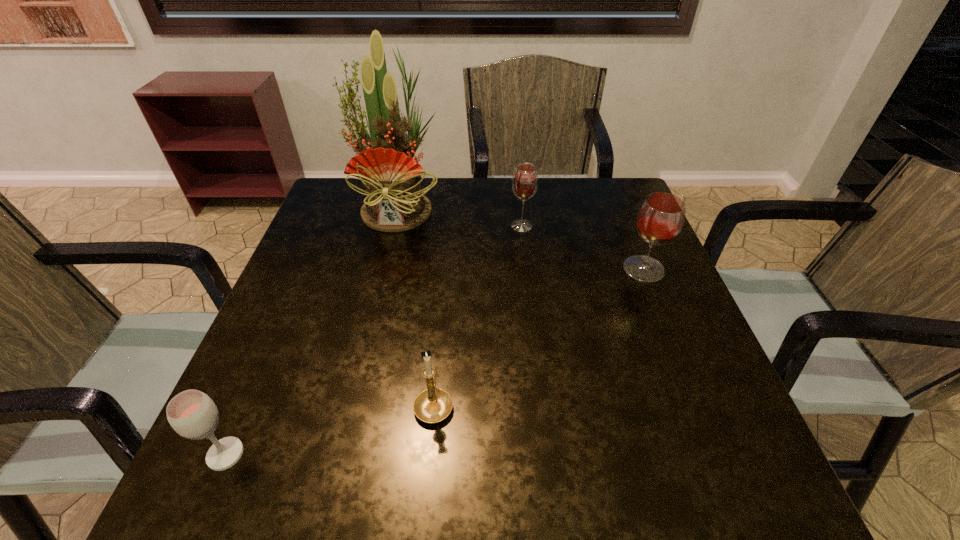
At what (x,y) coordinates should I click in order to perform the action: click on vacant region located 0.160m on the right of the second object from right to left. Please return your answer as a coordinate pair (x, y). Looking at the image, I should click on (595, 226).

Where is `vacant space located 0.110m on the handle side of the fourth farthest object`? The width and height of the screenshot is (960, 540). vacant space located 0.110m on the handle side of the fourth farthest object is located at coordinates [440, 336].

The height and width of the screenshot is (540, 960). Identify the location of free space located 0.390m on the handle side of the fourth farthest object. (447, 248).

The width and height of the screenshot is (960, 540). What are the coordinates of `free point located 0.110m on the handle side of the fourth farthest object` in the screenshot? It's located at (440, 336).

In order to click on free region located on the back of the nearest wineglass in this screenshot , I will do `click(290, 305)`.

Identify the location of flower arrangement present at the far edge. The width and height of the screenshot is (960, 540). (391, 177).

Where is `wineglass at the far edge`? The image size is (960, 540). wineglass at the far edge is located at coordinates (525, 181).

Find the location of `object positioned at the near edge`. object positioned at the near edge is located at coordinates (192, 414).

I want to click on flower arrangement that is at the left edge, so click(391, 177).

The height and width of the screenshot is (540, 960). What are the coordinates of `wineglass at the left edge` in the screenshot? It's located at (192, 414).